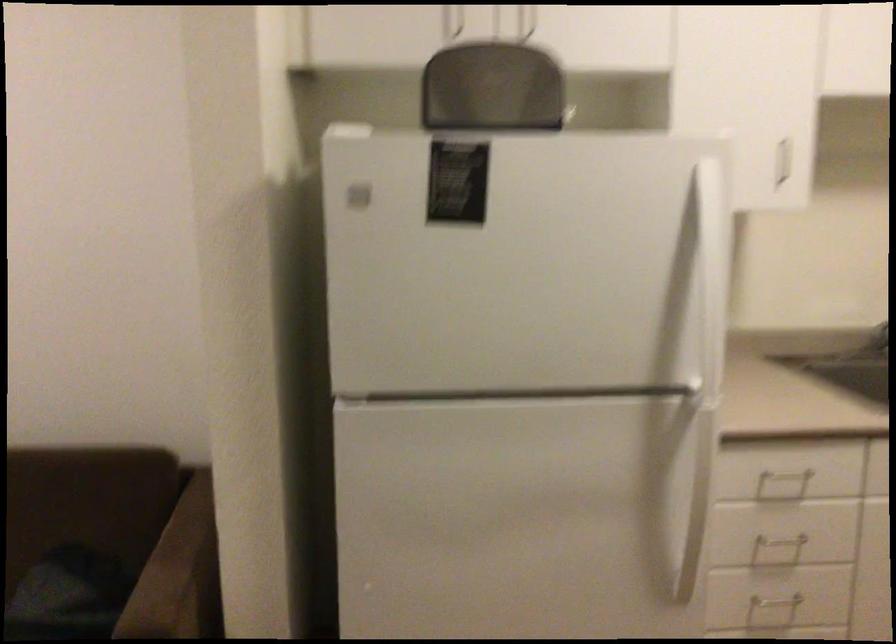
Find the location of a particular element. freezer door handle is located at coordinates pos(711,272).